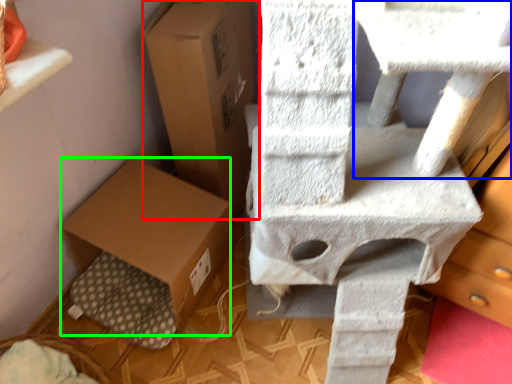
Question: Which object is positioned closest to cardboard box (highlighted by a red box)? Select from table (highlighted by a blue box) and cardboard box (highlighted by a green box).

Choices:
 (A) table
 (B) cardboard box

Answer: (B)